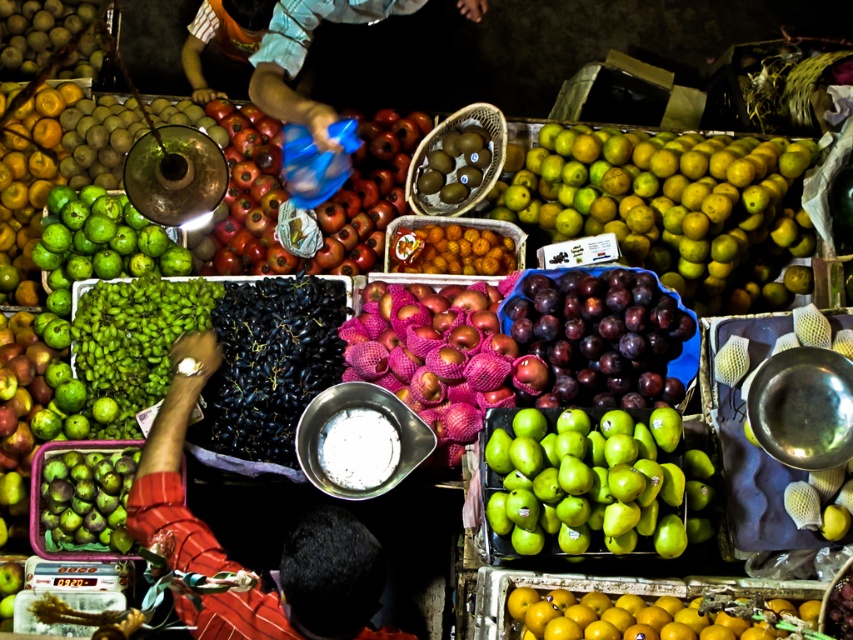
Question: Is green matte pears at center to the right of smooth green apple at center from the viewer's perspective?

Choices:
 (A) no
 (B) yes

Answer: (B)

Question: Is green matte pears at center smaller than shiny red pomegranate at center?

Choices:
 (A) yes
 (B) no

Answer: (A)

Question: Can you confirm if smooth green apple at center is wider than orange matte at center?

Choices:
 (A) no
 (B) yes

Answer: (B)

Question: Which object is farther from the camera taking this photo?

Choices:
 (A) green matte figs at lower left
 (B) blue plastic bag at center

Answer: (B)

Question: Estimate the real-world distances between objects in this image. Which object is farther from the shiny brown kiwi at center?

Choices:
 (A) blue plastic bag at center
 (B) red sleeve at center
 (C) green matte pears at center
 (D) pink mesh bagged apples at center

Answer: (B)

Question: Which object is farther from the camera taking this photo?

Choices:
 (A) red sleeve at center
 (B) shiny brown kiwi at center

Answer: (B)